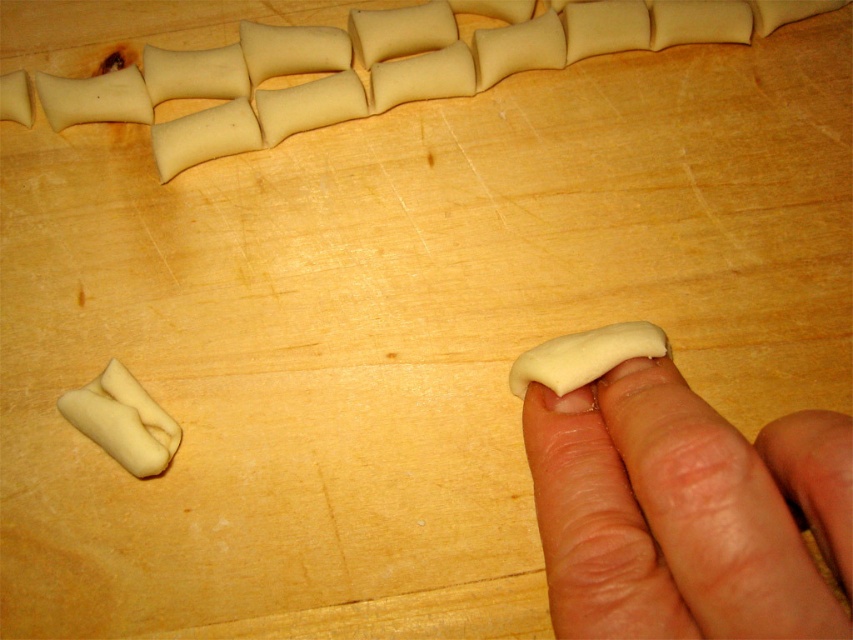
You are a baker preparing dough pieces on a wooden surface. You notice the smooth flesh at center and the white dough at upper center. Which object is positioned to the right of the other?

The smooth flesh at center is to the right of the white dough at upper center.

You are a baker trying to arrange dough pieces on a tray. You see the white dough at upper center and the white dough at center. Which dough piece is closer to your hand when you reach out to pick them up?

The white dough at upper center is closer to your hand because it is further to the viewer than the white dough at center.

You are a baker observing the dough pieces on the wooden surface. You notice the smooth flesh at center and the white dough at center. Which object is located to the right of the other?

The smooth flesh at center is positioned on the right side of white dough at center.